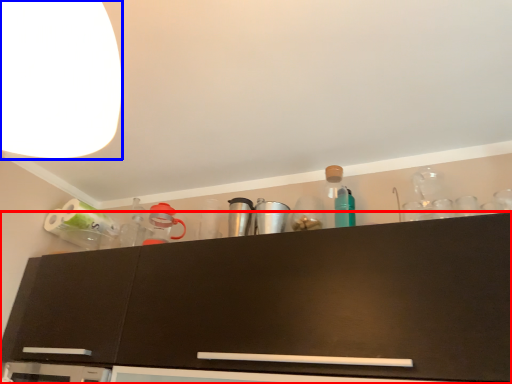
Question: Which point is closer to the camera, cabinetry (highlighted by a red box) or lamp (highlighted by a blue box)?

Choices:
 (A) cabinetry
 (B) lamp

Answer: (B)